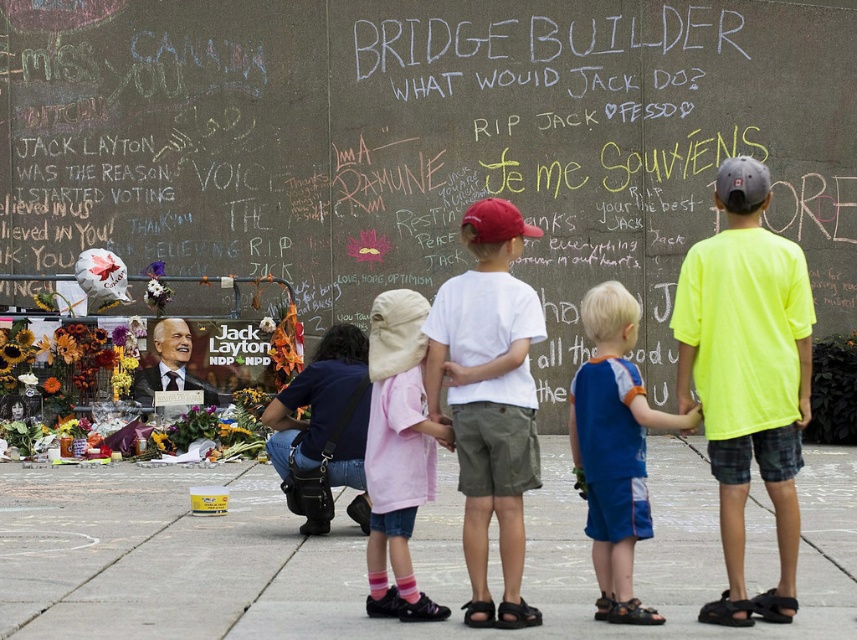
You are a photographer standing in front of the chalkboard wall with the white cotton shirt at center and the pink fabric dress at center. You want to take a photo that includes both items without any overlap. Given their positions, can you position yourself in a way that captures both fully in the frame?

The white cotton shirt at center might be wider than pink fabric dress at center, so you should position yourself to the side of the wider item to ensure both fit in the frame without overlapping.

You are standing at the memorial and want to place a flower at the point closer to the chalkboard wall. Which point should you choose between point (484, 220) and point (394, 561)?

Point (484, 220) is in front of point (394, 561), so it is closer to the chalkboard wall. You should choose point (484, 220) to place the flower.